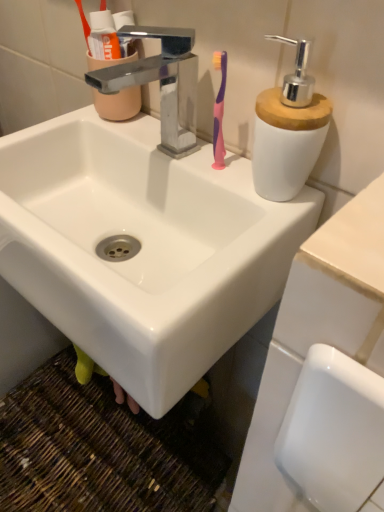
Question: From a real-world perspective, is translucent plastic cup at upper left physically located above or below satin nickel faucet at center?

Choices:
 (A) below
 (B) above

Answer: (B)

Question: In terms of width, does translucent plastic cup at upper left look wider or thinner when compared to satin nickel faucet at center?

Choices:
 (A) thin
 (B) wide

Answer: (A)

Question: Which of these objects is positioned farthest from the translucent plastic cup at upper left?

Choices:
 (A) satin nickel faucet at center
 (B) white ceramic sink at center

Answer: (B)

Question: Which of these objects is positioned closest to the satin nickel faucet at center?

Choices:
 (A) translucent plastic cup at upper left
 (B) white ceramic sink at center

Answer: (A)